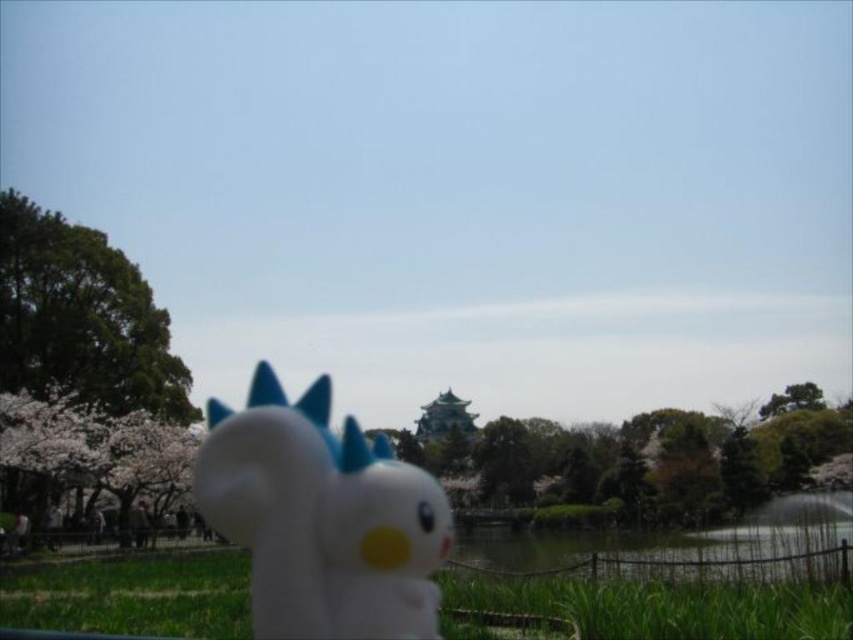
Does white matte plush toy at center appear on the right side of green grass at lower center?

In fact, white matte plush toy at center is to the left of green grass at lower center.

Does white matte plush toy at center appear on the left side of green grass at lower center?

Correct, you'll find white matte plush toy at center to the left of green grass at lower center.

This screenshot has height=640, width=853. What do you see at coordinates (321, 516) in the screenshot?
I see `white matte plush toy at center` at bounding box center [321, 516].

Find the location of a particular element. This screenshot has height=640, width=853. white matte plush toy at center is located at coordinates (321, 516).